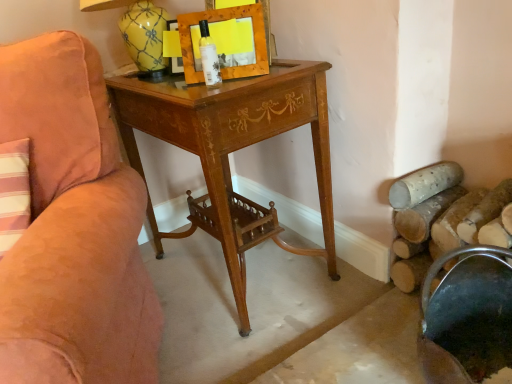
Where is `metallic dark green bucket at lower right`? Image resolution: width=512 pixels, height=384 pixels. metallic dark green bucket at lower right is located at coordinates (468, 319).

What do you see at coordinates (209, 56) in the screenshot?
I see `clear glass bottle at center` at bounding box center [209, 56].

This screenshot has height=384, width=512. I want to click on metallic dark green bucket at lower right, so click(x=468, y=319).

Between clear glass bottle at center and suede-like peach chair at left, which one has smaller width?

clear glass bottle at center.

Is the position of clear glass bottle at center more distant than that of suede-like peach chair at left?

Yes, it is.

From their relative heights in the image, would you say clear glass bottle at center is taller or shorter than suede-like peach chair at left?

clear glass bottle at center is shorter than suede-like peach chair at left.

Considering the relative positions of suede-like peach chair at left and wooden desk at center in the image provided, is suede-like peach chair at left to the right of wooden desk at center from the viewer's perspective?

Incorrect, suede-like peach chair at left is not on the right side of wooden desk at center.

Is suede-like peach chair at left thinner than wooden desk at center?

Incorrect, the width of suede-like peach chair at left is not less than that of wooden desk at center.

Is wooden desk at center inside suede-like peach chair at left?

Definitely not — wooden desk at center is not inside suede-like peach chair at left.

Where is `chair that appears below the wooden desk at center (from the image's perspective)`? chair that appears below the wooden desk at center (from the image's perspective) is located at coordinates (75, 221).

From a real-world perspective, which is physically below, metallic dark green bucket at lower right or wooden desk at center?

metallic dark green bucket at lower right.

Is point (495, 323) more distant than point (180, 95)?

No, (495, 323) is closer to viewer.

Is metallic dark green bucket at lower right taller than wooden desk at center?

No, metallic dark green bucket at lower right is not taller than wooden desk at center.

Does metallic dark green bucket at lower right have a smaller size compared to wooden desk at center?

Indeed, metallic dark green bucket at lower right has a smaller size compared to wooden desk at center.

In terms of height, does wooden picture frame at upper center look taller or shorter compared to wooden desk at center?

In the image, wooden picture frame at upper center appears to be shorter than wooden desk at center.

Would you consider wooden picture frame at upper center to be distant from wooden desk at center?

That's not correct — wooden picture frame at upper center is a little close to wooden desk at center.

Looking at the image, does wooden picture frame at upper center seem bigger or smaller compared to wooden desk at center?

Considering their sizes, wooden picture frame at upper center takes up less space than wooden desk at center.

How far apart are metallic dark green bucket at lower right and wooden picture frame at upper center?

metallic dark green bucket at lower right and wooden picture frame at upper center are 77.37 centimeters apart from each other.

Considering the positions of objects metallic dark green bucket at lower right and wooden picture frame at upper center in the image provided, who is more to the right, metallic dark green bucket at lower right or wooden picture frame at upper center?

metallic dark green bucket at lower right.

From the image's perspective, is metallic dark green bucket at lower right located above wooden picture frame at upper center?

No, from the image's perspective, metallic dark green bucket at lower right is not above wooden picture frame at upper center.

Between metallic dark green bucket at lower right and wooden picture frame at upper center, which one has smaller width?

wooden picture frame at upper center is thinner.

Is there a large distance between wooden desk at center and suede-like peach chair at left?

wooden desk at center is near suede-like peach chair at left, not far away.

From the image's perspective, is wooden desk at center on suede-like peach chair at left?

Yes, from the image's perspective, wooden desk at center is over suede-like peach chair at left.

Which object is more forward, wooden desk at center or suede-like peach chair at left?

suede-like peach chair at left is in front.

In the scene shown: Is wooden desk at center turned away from suede-like peach chair at left?

No.

Locate an element on the screen. This screenshot has height=384, width=512. chair that appears on the left of metallic dark green bucket at lower right is located at coordinates (75, 221).

From a real-world perspective, who is located higher, metallic dark green bucket at lower right or suede-like peach chair at left?

suede-like peach chair at left is physically above.

Is metallic dark green bucket at lower right oriented towards suede-like peach chair at left?

No.

Identify the location of chair on the left of clear glass bottle at center. (75, 221).

Find the location of a particular element. chair that is above the wooden desk at center (from a real-world perspective) is located at coordinates (75, 221).

From the image, which object appears to be nearer to metallic dark green bucket at lower right, wooden picture frame at upper center or wooden desk at center?

Among the two, wooden desk at center is located nearer to metallic dark green bucket at lower right.

Estimate the real-world distances between objects in this image. Which object is closer to suede-like peach chair at left, metallic dark green bucket at lower right or clear glass bottle at center?

The object closer to suede-like peach chair at left is clear glass bottle at center.

Considering their positions, is wooden picture frame at upper center positioned further to clear glass bottle at center than wooden desk at center?

wooden desk at center lies further to clear glass bottle at center than the other object.

Based on their spatial positions, is wooden desk at center or metallic dark green bucket at lower right closer to wooden picture frame at upper center?

wooden desk at center is closer to wooden picture frame at upper center.

From the image, which object appears to be farther from wooden picture frame at upper center, metallic dark green bucket at lower right or clear glass bottle at center?

metallic dark green bucket at lower right lies further to wooden picture frame at upper center than the other object.

Estimate the real-world distances between objects in this image. Which object is closer to metallic dark green bucket at lower right, wooden picture frame at upper center or suede-like peach chair at left?

The object closer to metallic dark green bucket at lower right is suede-like peach chair at left.

Based on their spatial positions, is metallic dark green bucket at lower right or wooden desk at center further from suede-like peach chair at left?

metallic dark green bucket at lower right lies further to suede-like peach chair at left than the other object.

Estimate the real-world distances between objects in this image. Which object is closer to metallic dark green bucket at lower right, wooden desk at center or wooden picture frame at upper center?

wooden desk at center is closer to metallic dark green bucket at lower right.

Identify the location of bottle between wooden picture frame at upper center and wooden desk at center in the up-down direction. (209, 56).

Locate an element on the screen. This screenshot has height=384, width=512. desk between suede-like peach chair at left and clear glass bottle at center from front to back is located at coordinates (232, 151).

Find the location of `desk that lies between wooden picture frame at upper center and metallic dark green bucket at lower right from top to bottom`. desk that lies between wooden picture frame at upper center and metallic dark green bucket at lower right from top to bottom is located at coordinates (232, 151).

Where is `desk between clear glass bottle at center and metallic dark green bucket at lower right in the vertical direction`? The image size is (512, 384). desk between clear glass bottle at center and metallic dark green bucket at lower right in the vertical direction is located at coordinates (232, 151).